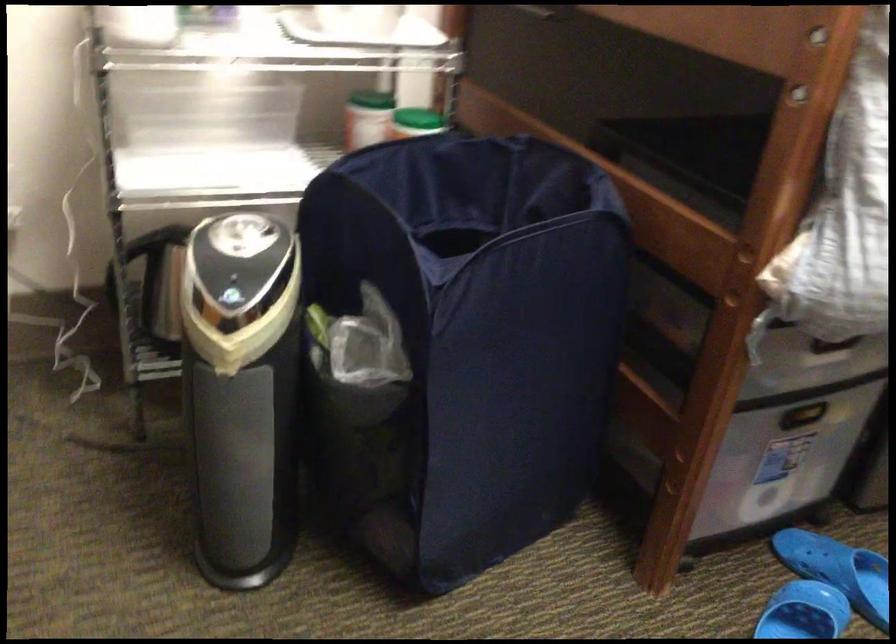
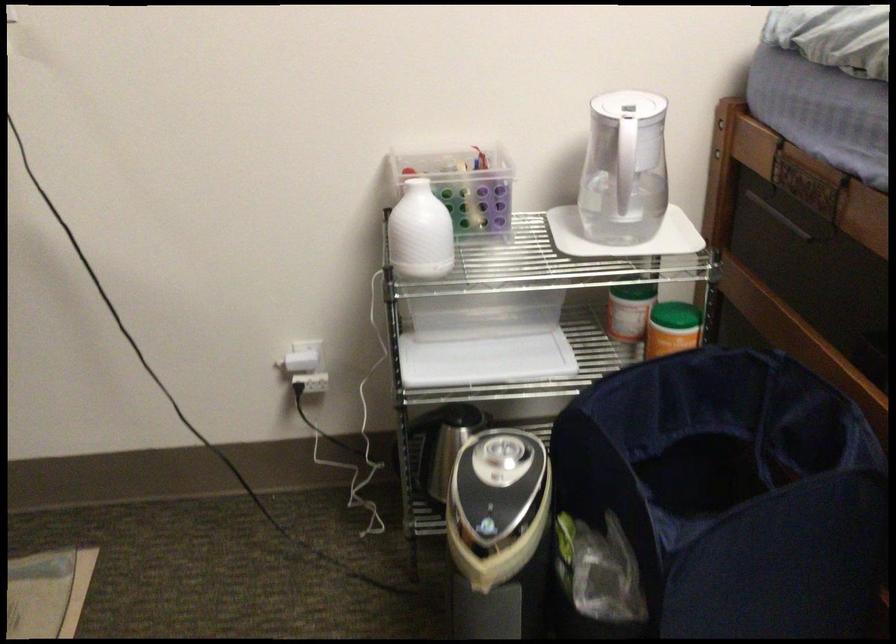
In the second image, find the point that corresponds to pixel 376 137 in the first image.

(635, 325)